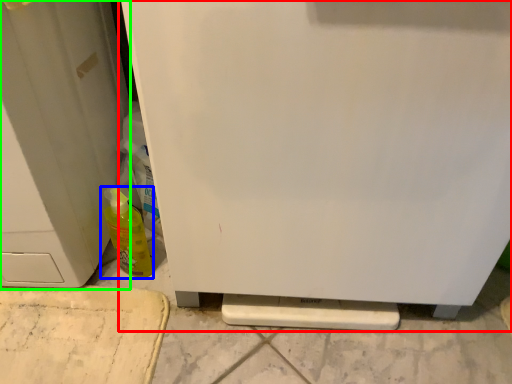
Question: Estimate the real-world distances between objects in this image. Which object is closer to refrigerator (highlighted by a red box), bottle (highlighted by a blue box) or door (highlighted by a green box)?

Choices:
 (A) bottle
 (B) door

Answer: (B)